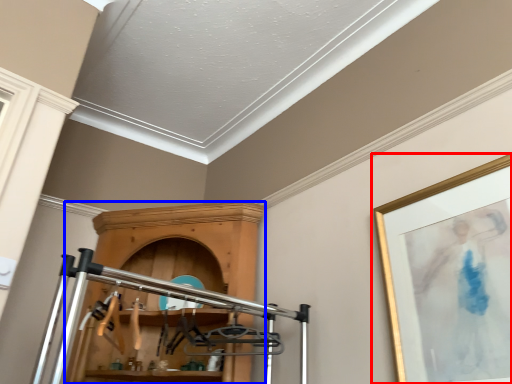
Question: Among these objects, which one is farthest to the camera, picture frame (highlighted by a red box) or furniture (highlighted by a blue box)?

Choices:
 (A) picture frame
 (B) furniture

Answer: (B)